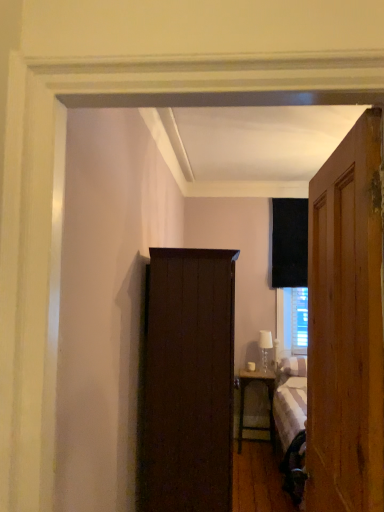
This screenshot has height=512, width=384. What are the coordinates of `wooden door at right` in the screenshot? It's located at (x=346, y=327).

In the scene shown: Measure the distance between point (259, 339) and camera.

Point (259, 339) and camera are 4.45 meters apart from each other.

What is the approximate width of white glass table lamp at right?

5.49 inches.

At what (x,y) coordinates should I click in order to perform the action: click on wooden door at right. Please return your answer as a coordinate pair (x, y). This screenshot has height=512, width=384. Looking at the image, I should click on (346, 327).

Locate an element on the screen. This screenshot has width=384, height=512. table lamp on the right of wooden nightstand at right is located at coordinates click(265, 347).

Is white glass table lamp at right far from wooden nightstand at right?

No.

Between white glass table lamp at right and wooden nightstand at right, which one has smaller width?

Thinner between the two is white glass table lamp at right.

Can you confirm if white glass table lamp at right is smaller than wooden door at right?

Indeed, white glass table lamp at right has a smaller size compared to wooden door at right.

From the picture: Does white glass table lamp at right turn towards wooden door at right?

Yes, white glass table lamp at right is aimed at wooden door at right.

Considering the sizes of white glass table lamp at right and wooden door at right in the image, is white glass table lamp at right wider or thinner than wooden door at right?

In the image, white glass table lamp at right appears to be more narrow than wooden door at right.

In the image, is white glass table lamp at right positioned in front of or behind wooden door at right?

Clearly, white glass table lamp at right is behind wooden door at right.

Could you tell me if dark wood cupboard at left is facing wooden door at right?

No, dark wood cupboard at left does not turn towards wooden door at right.

Between point (156, 350) and point (344, 295), which one is positioned in front?

The point (344, 295) is closer.

From a real-world perspective, does dark wood cupboard at left stand above wooden door at right?

No, from a real-world perspective, dark wood cupboard at left is not over wooden door at right

Can you confirm if dark wood cupboard at left is shorter than wooden door at right?

In fact, dark wood cupboard at left may be taller than wooden door at right.

Which is more to the right, wooden nightstand at right or wooden door at right?

wooden nightstand at right is more to the right.

Is wooden nightstand at right far away from wooden door at right?

That's right, there is a large distance between wooden nightstand at right and wooden door at right.

Is point (240, 403) more distant than point (346, 300)?

Yes, it is.

In the scene shown: Considering the relative sizes of wooden nightstand at right and wooden door at right in the image provided, is wooden nightstand at right wider than wooden door at right?

Correct, the width of wooden nightstand at right exceeds that of wooden door at right.

Considering the sizes of objects wooden door at right and wooden nightstand at right in the image provided, who is wider, wooden door at right or wooden nightstand at right?

wooden nightstand at right.

Is wooden door at right directly adjacent to wooden nightstand at right?

No, wooden door at right is not beside wooden nightstand at right.

From the picture: Can you tell me how much wooden door at right and wooden nightstand at right differ in facing direction?

The facing directions of wooden door at right and wooden nightstand at right are 91.7 degrees apart.

Is wooden door at right in front of or behind wooden nightstand at right in the image?

wooden door at right is in front of wooden nightstand at right.

Considering the points (188, 375) and (261, 340), which point is in front, point (188, 375) or point (261, 340)?

Point (188, 375)

Based on the photo, who is taller, dark wood cupboard at left or white glass table lamp at right?

dark wood cupboard at left is taller.

Relative to white glass table lamp at right, is dark wood cupboard at left in front or behind?

dark wood cupboard at left is in front of white glass table lamp at right.

Is white glass table lamp at right at the back of dark wood cupboard at left?

No, white glass table lamp at right is not at the back of dark wood cupboard at left.

Is wooden nightstand at right not close to white glass table lamp at right?

No, wooden nightstand at right is not far from white glass table lamp at right.

Is wooden nightstand at right surrounding white glass table lamp at right?

That's incorrect, white glass table lamp at right is not inside wooden nightstand at right.

From the image's perspective, which object appears higher, wooden nightstand at right or white glass table lamp at right?

white glass table lamp at right.

Is wooden nightstand at right at the right side of white glass table lamp at right?

No, wooden nightstand at right is not to the right of white glass table lamp at right.

You are a GUI agent. You are given a task and a screenshot of the screen. Output one action in this format:
    pyautogui.click(x=<x>, y=<y>)
    Task: Click on the nightstand below the white glass table lamp at right (from the image's perspective)
    Image resolution: width=384 pixels, height=512 pixels.
    Given the screenshot: What is the action you would take?
    pyautogui.click(x=268, y=399)

In order to click on table lamp behind the wooden door at right in this screenshot , I will do `click(265, 347)`.

Which object lies further to the anchor point dark wood cupboard at left, white glass table lamp at right or wooden door at right?

Among the two, white glass table lamp at right is located further to dark wood cupboard at left.

When comparing their distances from wooden nightstand at right, does dark wood cupboard at left or white glass table lamp at right seem closer?

The object closer to wooden nightstand at right is white glass table lamp at right.

Which object lies further to the anchor point dark wood cupboard at left, wooden door at right or white glass table lamp at right?

Based on the image, white glass table lamp at right appears to be further to dark wood cupboard at left.

Estimate the real-world distances between objects in this image. Which object is further from wooden nightstand at right, wooden door at right or dark wood cupboard at left?

wooden door at right is positioned further to the anchor wooden nightstand at right.

Looking at this image, estimate the real-world distances between objects in this image. Which object is further from wooden nightstand at right, white glass table lamp at right or wooden door at right?

Among the two, wooden door at right is located further to wooden nightstand at right.

Looking at the image, which one is located closer to white glass table lamp at right, wooden nightstand at right or dark wood cupboard at left?

wooden nightstand at right is positioned closer to the anchor white glass table lamp at right.

When comparing their distances from wooden door at right, does wooden nightstand at right or dark wood cupboard at left seem closer?

dark wood cupboard at left.

From the image, which object appears to be farther from wooden door at right, wooden nightstand at right or white glass table lamp at right?

white glass table lamp at right is positioned further to the anchor wooden door at right.

Locate an element on the screen. The image size is (384, 512). cupboard positioned between wooden door at right and wooden nightstand at right from near to far is located at coordinates (188, 382).

Image resolution: width=384 pixels, height=512 pixels. Identify the location of nightstand located between dark wood cupboard at left and white glass table lamp at right in the depth direction. pos(268,399).

Identify the location of nightstand located between wooden door at right and white glass table lamp at right in the depth direction. This screenshot has height=512, width=384. (268, 399).

You are a GUI agent. You are given a task and a screenshot of the screen. Output one action in this format:
    pyautogui.click(x=<x>, y=<y>)
    Task: Click on the cupboard located between wooden door at right and white glass table lamp at right in the depth direction
    The height and width of the screenshot is (512, 384).
    Given the screenshot: What is the action you would take?
    pyautogui.click(x=188, y=382)